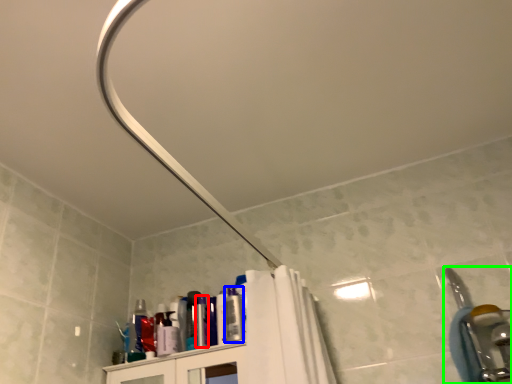
Question: Considering the real-world distances, which object is farthest from toiletry (highlighted by a red box)? toiletry (highlighted by a blue box) or plumbing fixture (highlighted by a green box)?

Choices:
 (A) toiletry
 (B) plumbing fixture

Answer: (B)